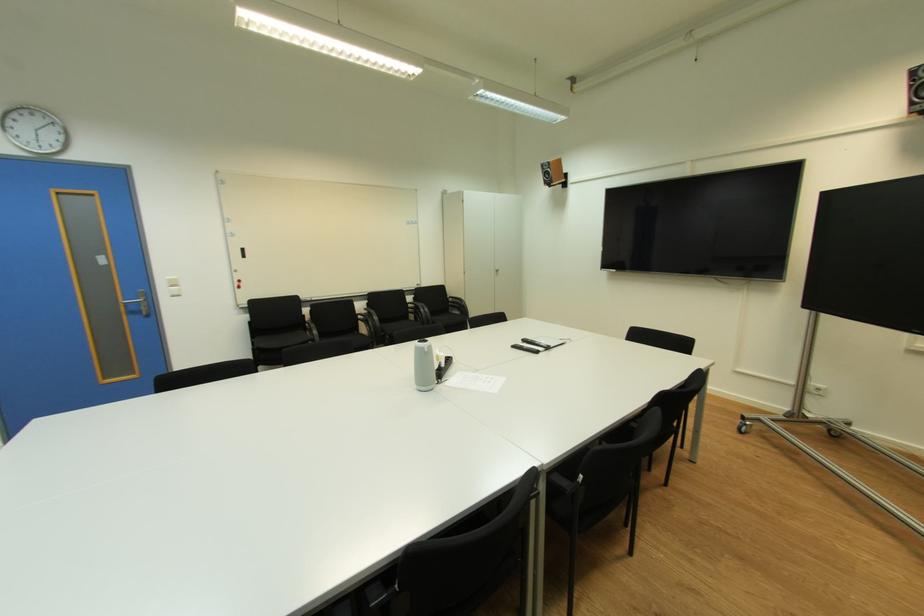
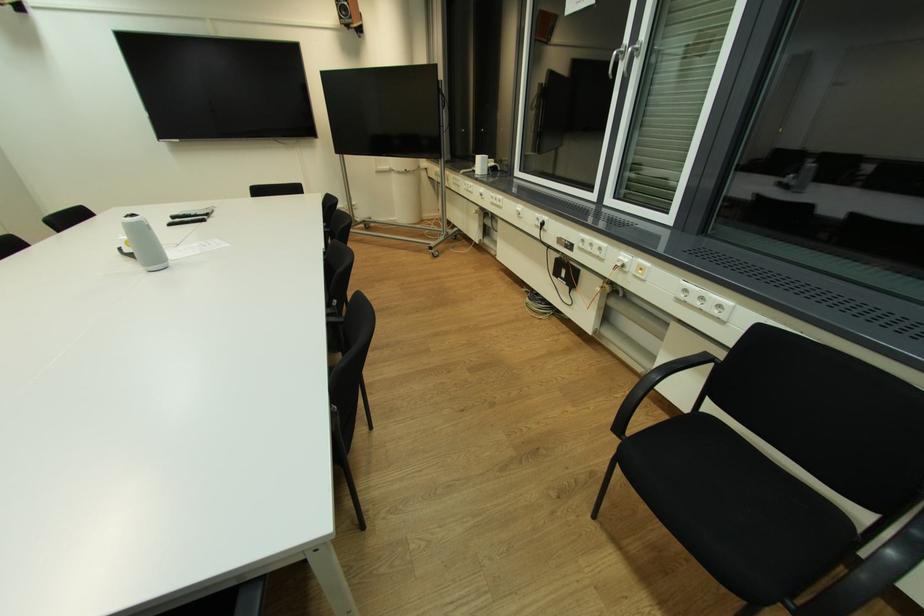
The point at [530,342] is marked in the first image. Where is the corresponding point in the second image?

(177, 219)